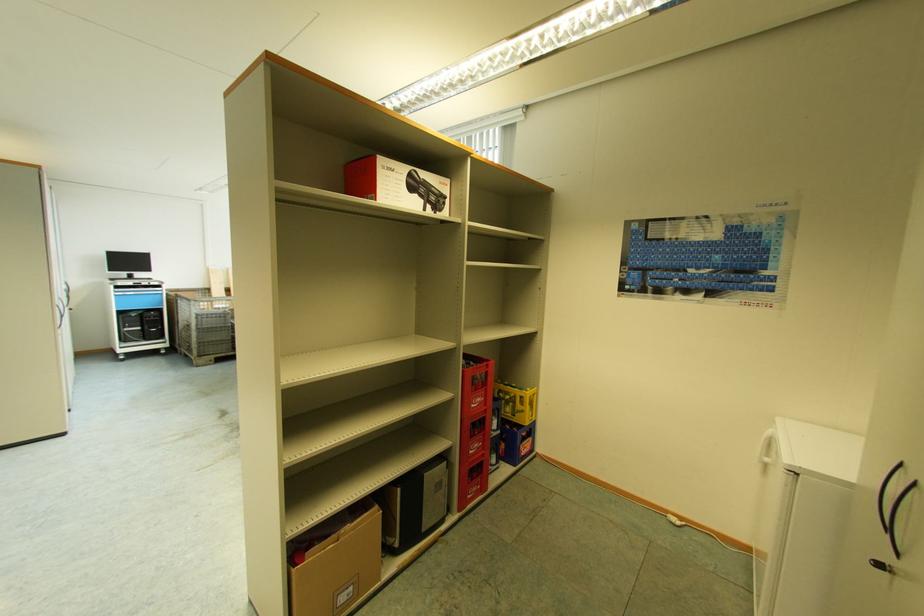
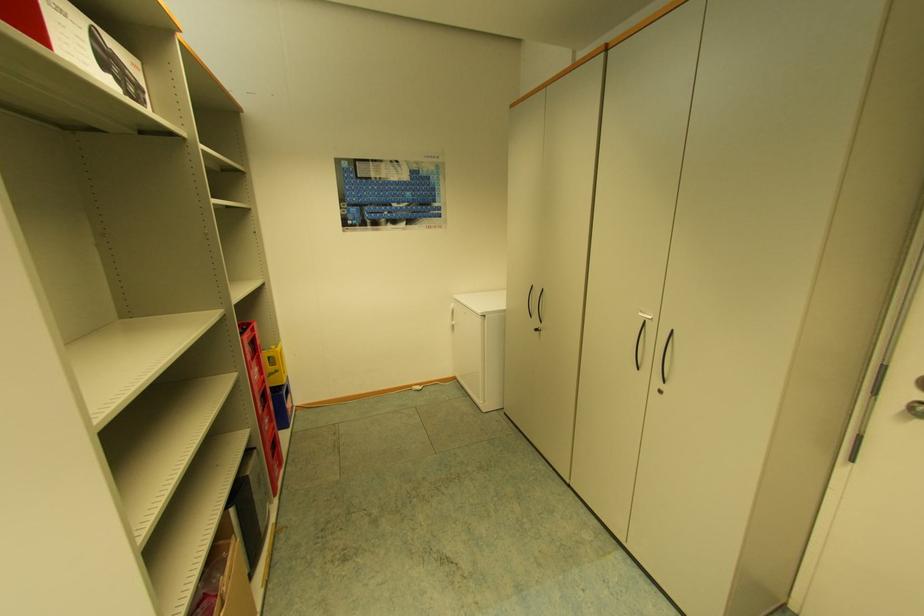
Locate, in the second image, the point that corresponds to point 526,411 in the first image.

(281, 371)